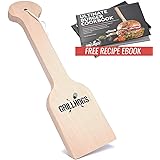
Identify the location of handle. This screenshot has height=160, width=160. pyautogui.click(x=22, y=5).